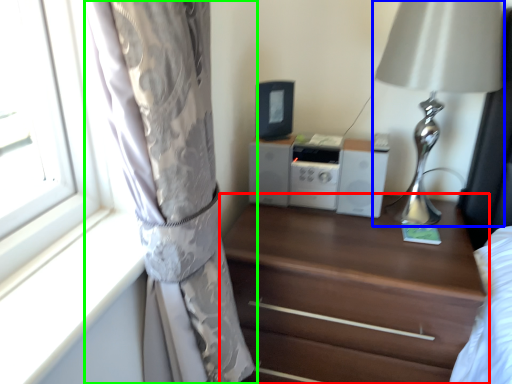
Question: Which object is positioned closest to chest of drawers (highlighted by a red box)? Select from table lamp (highlighted by a blue box) and curtain (highlighted by a green box).

Choices:
 (A) table lamp
 (B) curtain

Answer: (A)